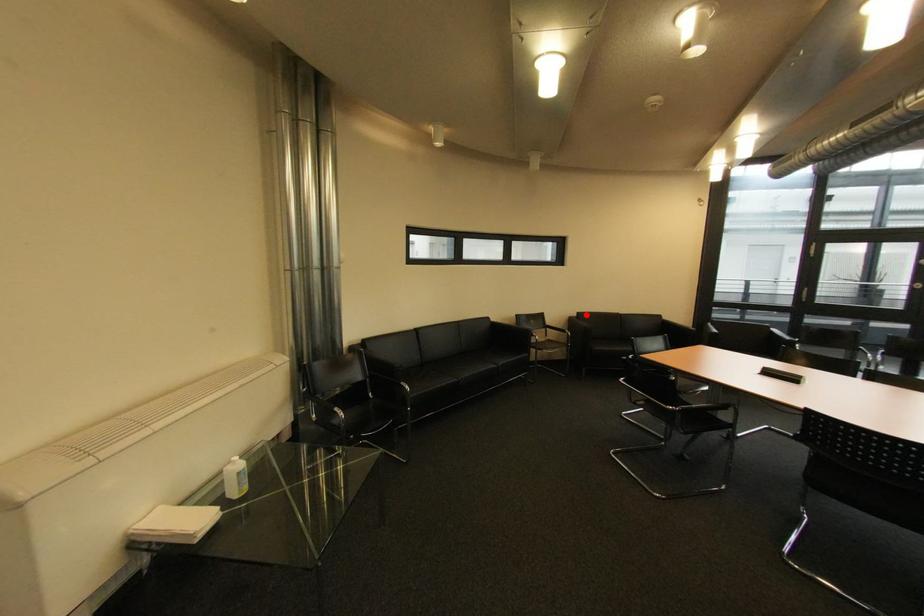
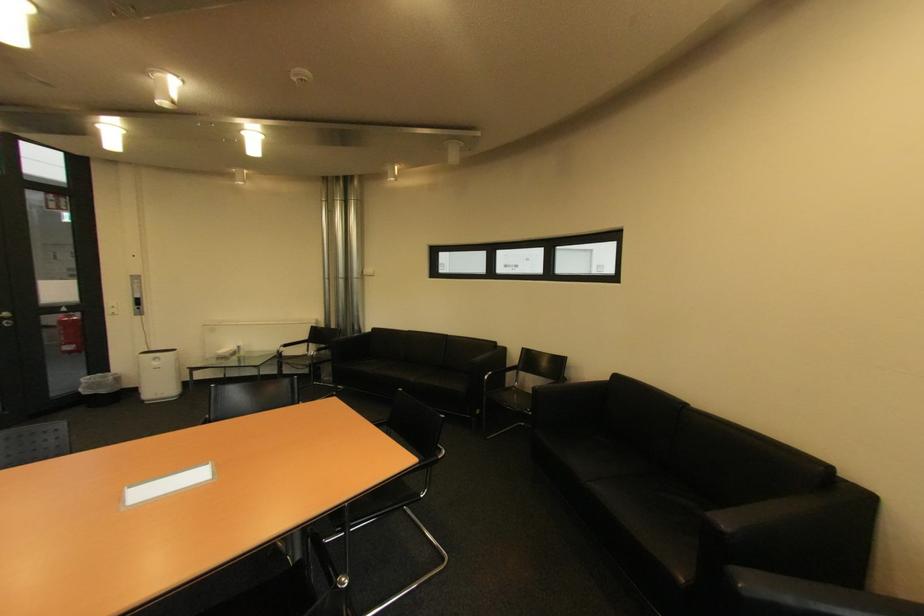
The point at the highlighted location is marked in the first image. Where is the corresponding point in the second image?

(625, 378)